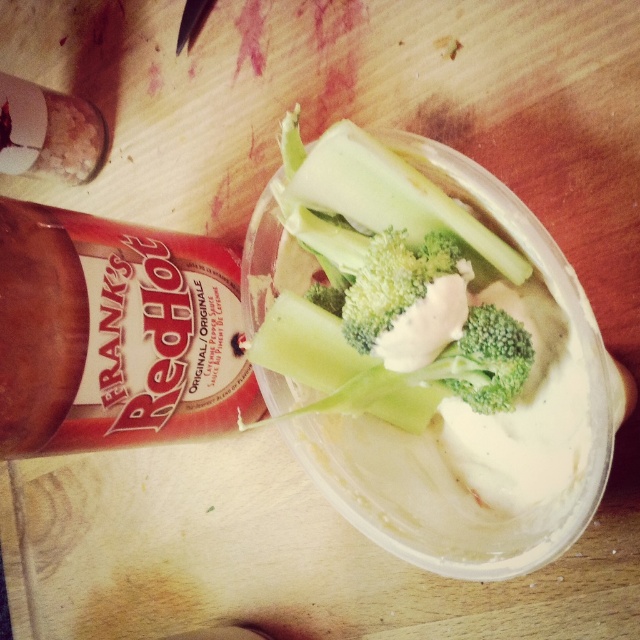
Question: Does matte brown bottle at upper left appear on the left side of green broccoli at center?

Choices:
 (A) no
 (B) yes

Answer: (B)

Question: Is red matte bottle at upper left behind matte brown bottle at upper left?

Choices:
 (A) no
 (B) yes

Answer: (A)

Question: Among these points, which one is farthest from the camera?

Choices:
 (A) (83, 116)
 (B) (492, 396)

Answer: (A)

Question: Estimate the real-world distances between objects in this image. Which object is farther from the matte brown bottle at upper left?

Choices:
 (A) green broccoli at center
 (B) red matte bottle at upper left

Answer: (A)

Question: Can you confirm if red matte bottle at upper left is positioned below green broccoli at center?

Choices:
 (A) no
 (B) yes

Answer: (A)

Question: Based on their relative distances, which object is nearer to the green matte broccoli at center?

Choices:
 (A) green broccoli at center
 (B) matte brown bottle at upper left

Answer: (A)